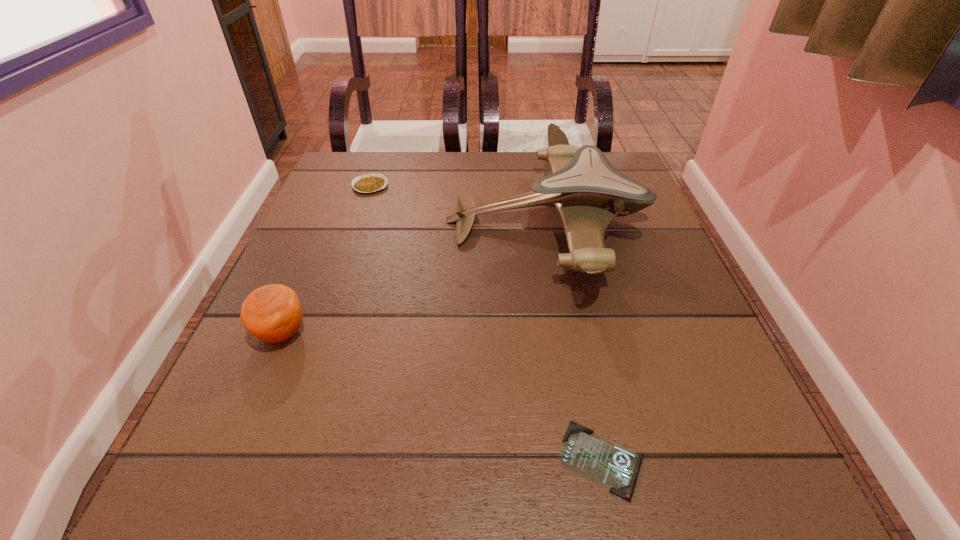
Locate an element on the screen. This screenshot has height=540, width=960. vacant area that lies between the third shortest object and the legume is located at coordinates (326, 259).

You are a GUI agent. You are given a task and a screenshot of the screen. Output one action in this format:
    pyautogui.click(x=<x>, y=<y>)
    Task: Click on the vacant space that's between the third tallest object and the orange
    Image resolution: width=960 pixels, height=540 pixels.
    Given the screenshot: What is the action you would take?
    pyautogui.click(x=326, y=259)

Where is `empty space between the tallest object and the identity card`? The width and height of the screenshot is (960, 540). empty space between the tallest object and the identity card is located at coordinates pyautogui.click(x=574, y=340).

In order to click on free spot between the orange and the legume in this screenshot , I will do `click(326, 259)`.

Identify which object is the closest to the orange. Please provide its 2D coordinates. Your answer should be formatted as a tuple, i.e. [(x, y)], where the tuple contains the x and y coordinates of a point satisfying the conditions above.

[(588, 192)]

Point out which object is positioned as the nearest to the tallest object. Please provide its 2D coordinates. Your answer should be formatted as a tuple, i.e. [(x, y)], where the tuple contains the x and y coordinates of a point satisfying the conditions above.

[(368, 183)]

The image size is (960, 540). I want to click on blank space that satisfies the following two spatial constraints: 1. on the front side of the shortest object; 2. on the left side of the second tallest object, so click(x=228, y=460).

The width and height of the screenshot is (960, 540). I want to click on vacant space that satisfies the following two spatial constraints: 1. on the front side of the second shortest object; 2. on the right side of the nearest object, so click(276, 460).

Where is `vacant space that satisfies the following two spatial constraints: 1. on the front-facing side of the shortest object; 2. on the left side of the drone`? The width and height of the screenshot is (960, 540). vacant space that satisfies the following two spatial constraints: 1. on the front-facing side of the shortest object; 2. on the left side of the drone is located at coordinates (592, 460).

The height and width of the screenshot is (540, 960). Identify the location of vacant position in the image that satisfies the following two spatial constraints: 1. on the front-facing side of the identity card; 2. on the left side of the drone. click(x=592, y=460).